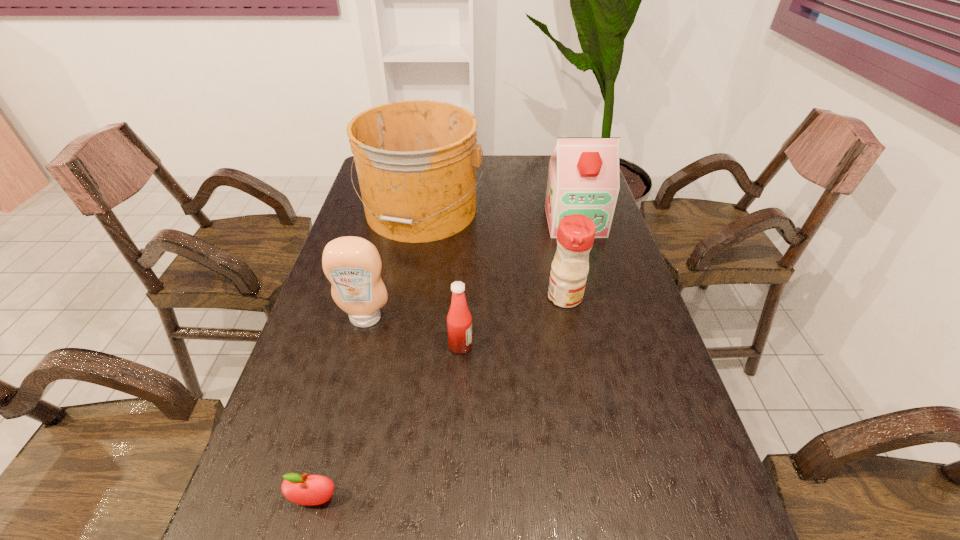
The width and height of the screenshot is (960, 540). Find the location of `vacant space located on the back of the rightmost condiment`. vacant space located on the back of the rightmost condiment is located at coordinates (560, 273).

In order to click on free space located on the label of the leftmost condiment in this screenshot , I will do `click(355, 359)`.

Locate an element on the screen. Image resolution: width=960 pixels, height=540 pixels. vacant space situated on the front-facing side of the second shortest object is located at coordinates (629, 346).

Image resolution: width=960 pixels, height=540 pixels. What are the coordinates of `blank area located on the back of the apple` in the screenshot? It's located at (345, 389).

Find the location of a particular element. object that is at the far edge is located at coordinates (416, 160).

Identify the location of bucket located in the left edge section of the desktop. The height and width of the screenshot is (540, 960). (416, 160).

Identify the location of condiment that is at the left edge. The image size is (960, 540). (353, 266).

At what (x,y) coordinates should I click in order to perform the action: click on apple located in the left edge section of the desktop. Please return your answer as a coordinate pair (x, y). This screenshot has height=540, width=960. Looking at the image, I should click on (309, 490).

Find the location of `soya milk situated at the right edge`. soya milk situated at the right edge is located at coordinates (583, 178).

Locate an element on the screen. Image resolution: width=960 pixels, height=540 pixels. condiment present at the right edge is located at coordinates (575, 236).